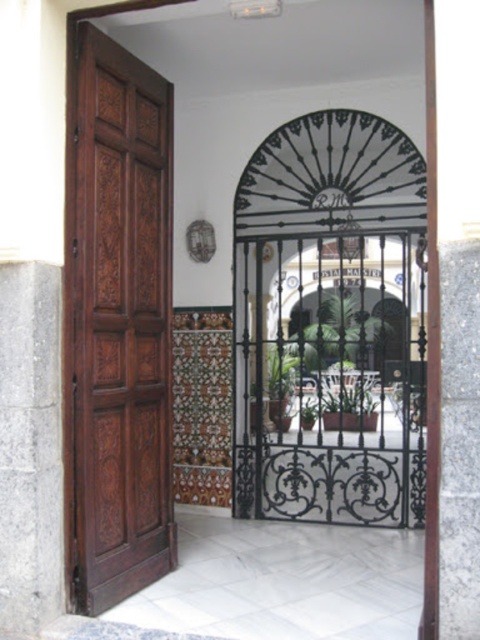
Question: Which point is farther from the camera taking this photo?

Choices:
 (A) (36, 502)
 (B) (90, 83)
 (C) (439, 531)

Answer: (B)

Question: Can you confirm if brown carved wood door at left is positioned below gray stone pillar at left?

Choices:
 (A) no
 (B) yes

Answer: (A)

Question: Estimate the real-world distances between objects in this image. Which object is closer to the gray stone pillar at left?

Choices:
 (A) brown carved wood door at left
 (B) brown wood pillar at right

Answer: (A)

Question: Is brown carved wood door at left to the right of brown wood pillar at right from the viewer's perspective?

Choices:
 (A) no
 (B) yes

Answer: (A)

Question: Which object is farther from the camera taking this photo?

Choices:
 (A) gray stone pillar at left
 (B) brown carved wood door at left

Answer: (B)

Question: Where is brown carved wood door at left located in relation to gray stone pillar at left in the image?

Choices:
 (A) right
 (B) left

Answer: (A)